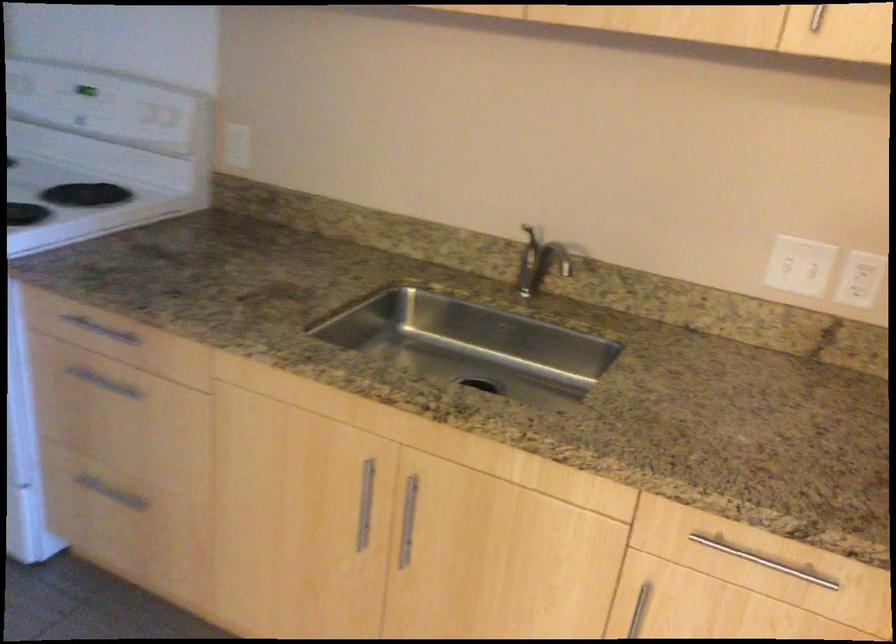
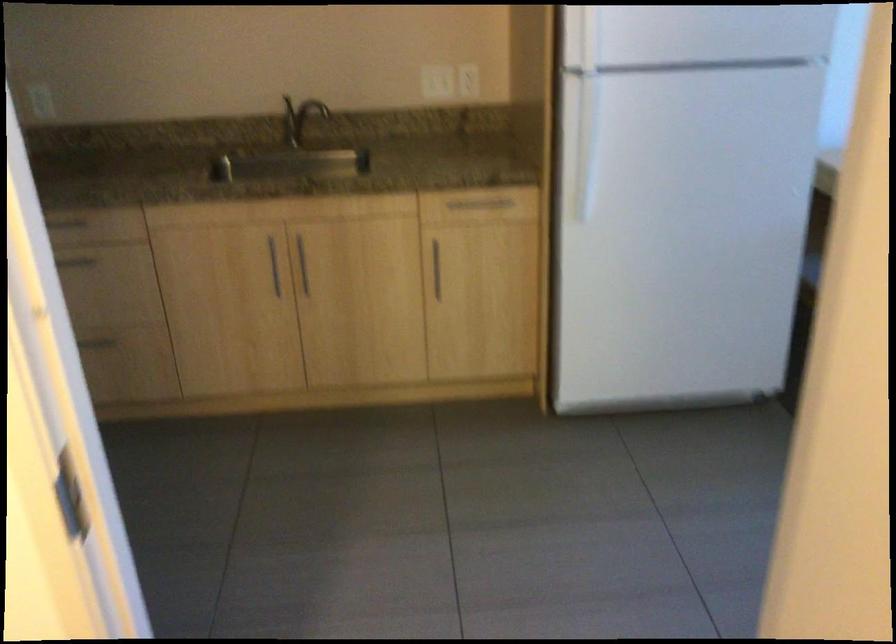
The point at (789, 257) is marked in the first image. Where is the corresponding point in the second image?

(433, 80)